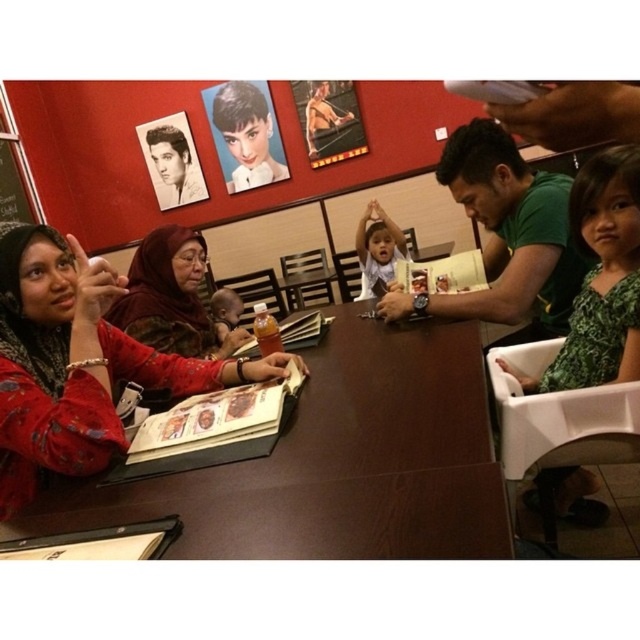
Question: Is matte red dress at left thinner than translucent plastic cup at table center?

Choices:
 (A) yes
 (B) no

Answer: (B)

Question: Can you confirm if matte red dress at left is positioned above translucent plastic cup at table center?

Choices:
 (A) no
 (B) yes

Answer: (A)

Question: Which object is the farthest from the green floral dress at lower right?

Choices:
 (A) matte red dress at left
 (B) translucent plastic cup at table center
 (C) reddish-brown fabric headscarf at upper left
 (D) brown wooden table at center

Answer: (C)

Question: Is brown wooden table at center smaller than translucent plastic cup at table center?

Choices:
 (A) yes
 (B) no

Answer: (B)

Question: Which of the following is the farthest from the observer?

Choices:
 (A) brown wooden table at center
 (B) matte red dress at left

Answer: (B)

Question: Among these points, which one is farthest from the camera?

Choices:
 (A) [609, 372]
 (B) [33, 282]
 (C) [372, 289]
 (D) [276, 339]

Answer: (C)